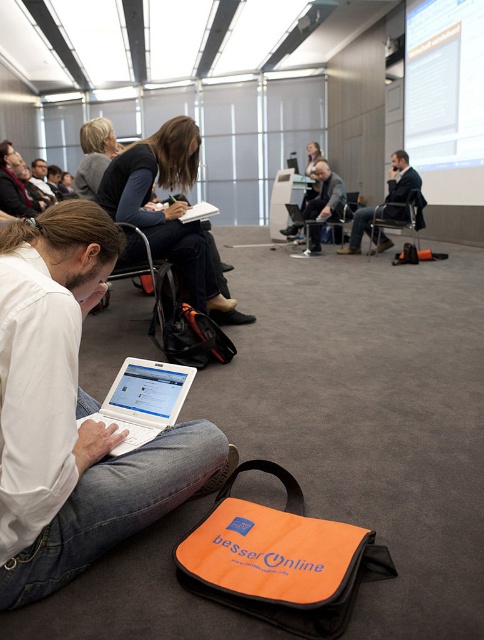
You are a photographer who needs to capture a closeup shot of the matte black jacket at center without moving any objects. The camera you are using has a minimum focusing distance of 3 meters. Can you take the photo as required?

The matte black jacket at center and camera are 2.84 meters apart from each other. Since the minimum focusing distance is 3 meters, the camera cannot focus close enough to take the photo without moving the camera or the jacket.

You are organizing a charity event and need to decide which jacket to display. The dark suit jacket at center and the matte black jacket at upper left are both options. Which one is wider?

The dark suit jacket at center is wider than the matte black jacket at upper left.

You are a photographer standing in the conference room and want to take a photo of the matte black hair at upper left and the matte black laptop at left. Which object should you focus on first if you want to capture both in sharp focus?

The matte black hair at upper left is closer to the viewer than the matte black laptop at left, so you should focus on the matte black hair at upper left first to ensure both are in sharp focus.